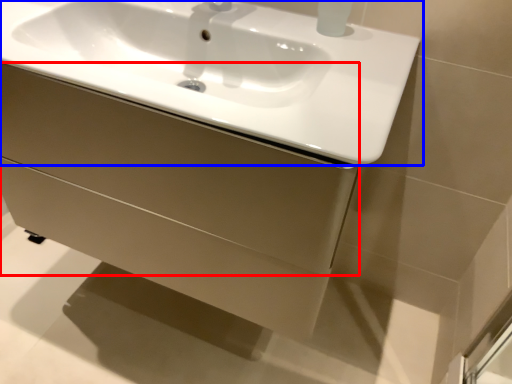
Question: Which of the following is the closest to the observer, drawer (highlighted by a red box) or sink (highlighted by a blue box)?

Choices:
 (A) drawer
 (B) sink

Answer: (B)